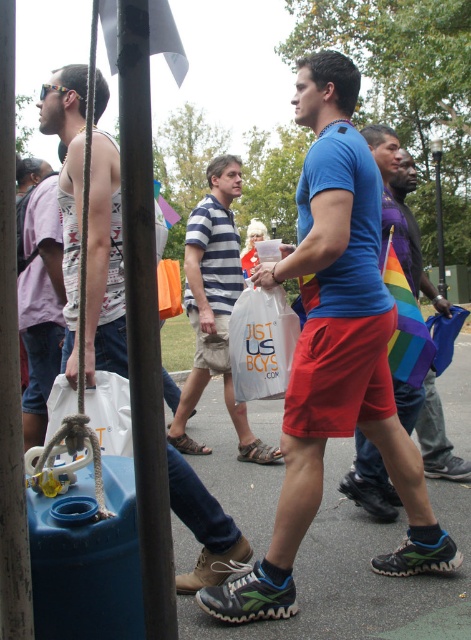
Consider the image. Who is shorter, matte white tank top at left or brushed metal pole at left?

With less height is brushed metal pole at left.

Does point (71, 355) come behind point (24, 563)?

Yes, it is.

Describe the element at coordinates (105, 264) in the screenshot. I see `matte white tank top at left` at that location.

Where is `matte white tank top at left`? The height and width of the screenshot is (640, 471). matte white tank top at left is located at coordinates (105, 264).

Is brushed metal pole at left shorter than matte blue t-shirt at center?

Yes, brushed metal pole at left is shorter than matte blue t-shirt at center.

Describe the element at coordinates (10, 369) in the screenshot. I see `brushed metal pole at left` at that location.

Is point (11, 337) positioned after point (346, 486)?

That is False.

The image size is (471, 640). Identify the location of brushed metal pole at left. (10, 369).

Measure the distance from striped cotton shirt at center to matte blue t-shirt at center.

striped cotton shirt at center and matte blue t-shirt at center are 1.50 meters apart from each other.

Is striped cotton shirt at center positioned behind matte blue t-shirt at center?

That is True.

Locate an element on the screen. This screenshot has height=640, width=471. striped cotton shirt at center is located at coordinates (214, 308).